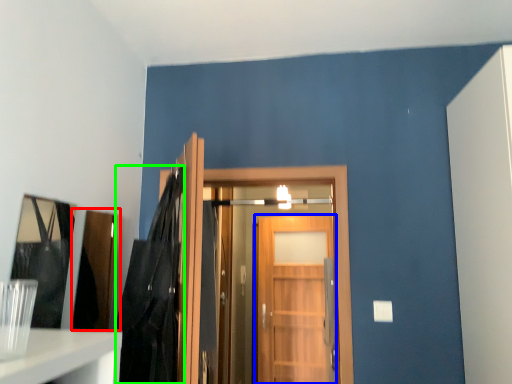
Question: Based on their relative distances, which object is farther from cabinetry (highlighted by a red box)? Choose from door (highlighted by a blue box) and dark (highlighted by a green box).

Choices:
 (A) door
 (B) dark

Answer: (A)